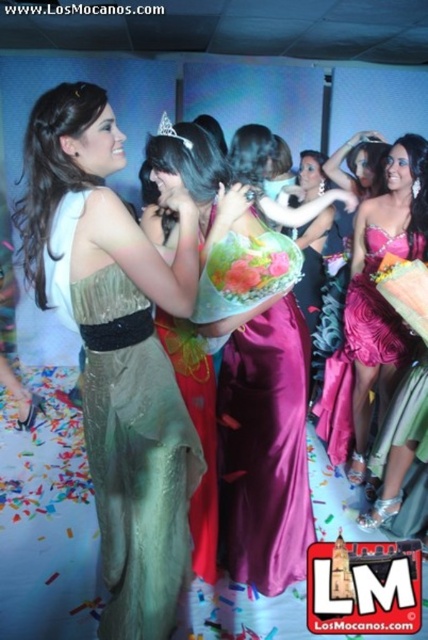
Question: Is green satin dress at center wider than shiny satin dress at center?

Choices:
 (A) no
 (B) yes

Answer: (A)

Question: Observing the image, what is the correct spatial positioning of shiny pink dress at center in reference to clear crystal tiara at upper center?

Choices:
 (A) left
 (B) right

Answer: (B)

Question: Estimate the real-world distances between objects in this image. Which object is farther from the green satin dress at center?

Choices:
 (A) silky purple dress at center
 (B) shiny pink dress at center

Answer: (B)

Question: Among these objects, which one is nearest to the camera?

Choices:
 (A) clear crystal tiara at upper center
 (B) satin gold dress at center

Answer: (B)

Question: Estimate the real-world distances between objects in this image. Which object is closer to the green satin dress at center?

Choices:
 (A) satin gold dress at center
 (B) silky purple dress at center

Answer: (A)

Question: Where is green satin dress at center located in relation to shiny pink dress at center in the image?

Choices:
 (A) above
 (B) below

Answer: (B)